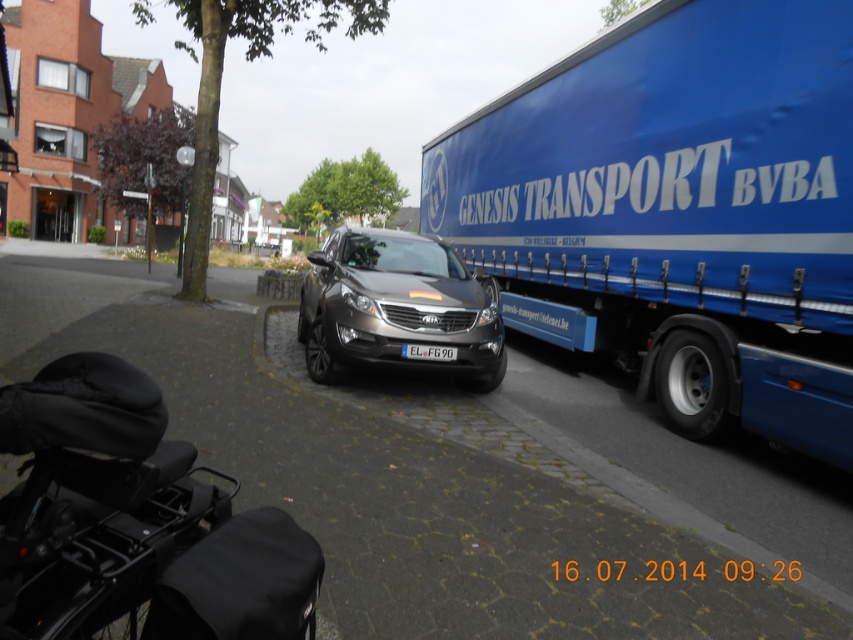
Question: Which point is closer to the camera?

Choices:
 (A) (634, 177)
 (B) (4, 596)
 (C) (460, 275)

Answer: (B)

Question: Can you confirm if blue matte truck at right is smaller than satin black car at center?

Choices:
 (A) yes
 (B) no

Answer: (B)

Question: Which point is farther to the camera?

Choices:
 (A) (x=144, y=435)
 (B) (x=418, y=301)
 (C) (x=582, y=180)

Answer: (C)

Question: Does black matte motorcycle at lower left appear under white plastic license plate at center?

Choices:
 (A) no
 (B) yes

Answer: (B)

Question: Does blue matte truck at right appear on the right side of black matte motorcycle at lower left?

Choices:
 (A) no
 (B) yes

Answer: (B)

Question: Among these objects, which one is nearest to the camera?

Choices:
 (A) blue matte truck at right
 (B) satin black car at center
 (C) black matte motorcycle at lower left

Answer: (C)